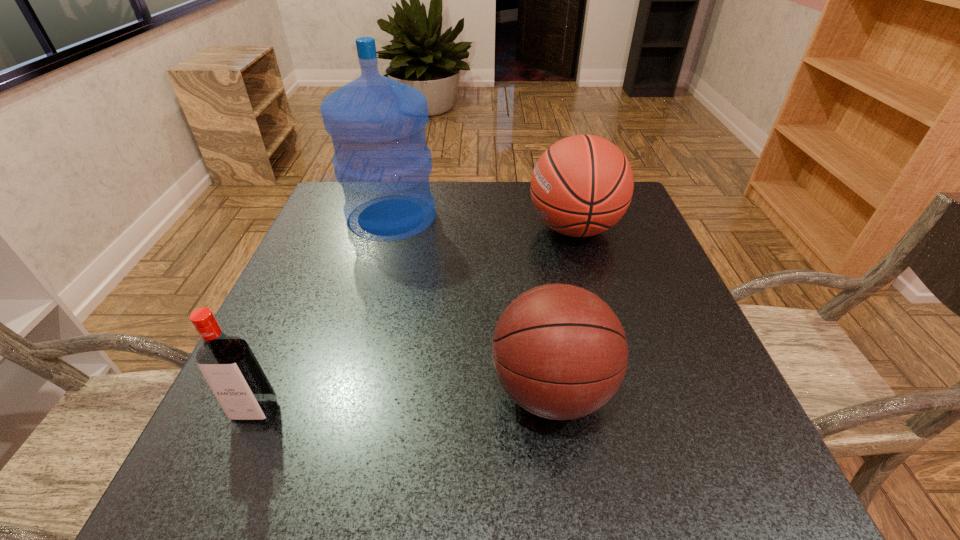
Locate an element on the screen. water jug present at the far edge is located at coordinates (377, 125).

I want to click on basketball that is at the far edge, so click(582, 185).

Image resolution: width=960 pixels, height=540 pixels. I want to click on object present at the near edge, so click(559, 351).

This screenshot has width=960, height=540. What are the coordinates of `water jug that is at the left edge` in the screenshot? It's located at (x=377, y=125).

This screenshot has width=960, height=540. I want to click on vodka that is at the left edge, so click(x=228, y=364).

Find the location of a particular element. object that is at the right edge is located at coordinates (582, 185).

At what (x,y) coordinates should I click in order to perform the action: click on object present at the far left corner. Please return your answer as a coordinate pair (x, y). The height and width of the screenshot is (540, 960). Looking at the image, I should click on (377, 125).

The image size is (960, 540). I want to click on object present at the far right corner, so click(582, 185).

Identify the location of free region at the far edge of the desktop. The width and height of the screenshot is (960, 540). click(487, 183).

The height and width of the screenshot is (540, 960). I want to click on free space at the near edge of the desktop, so [x=616, y=476].